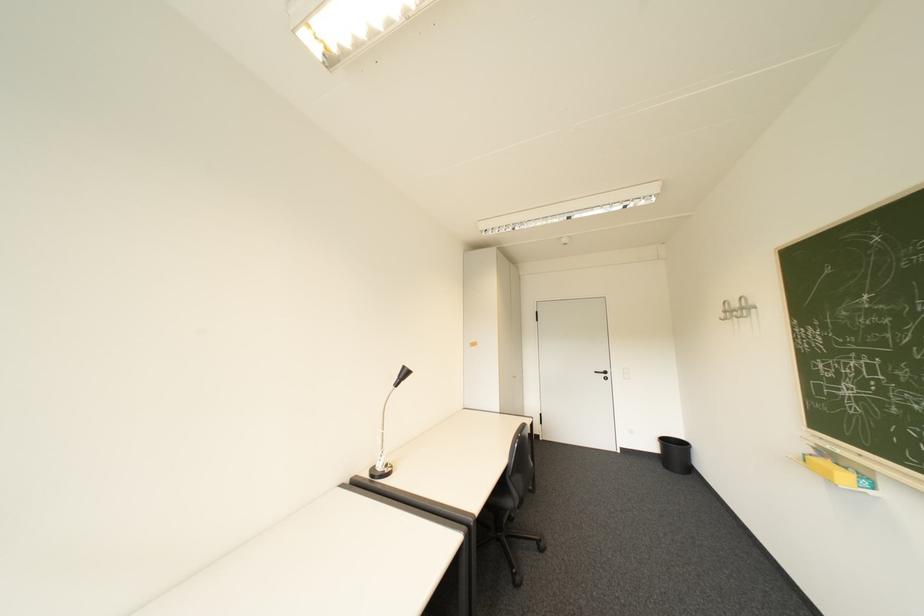
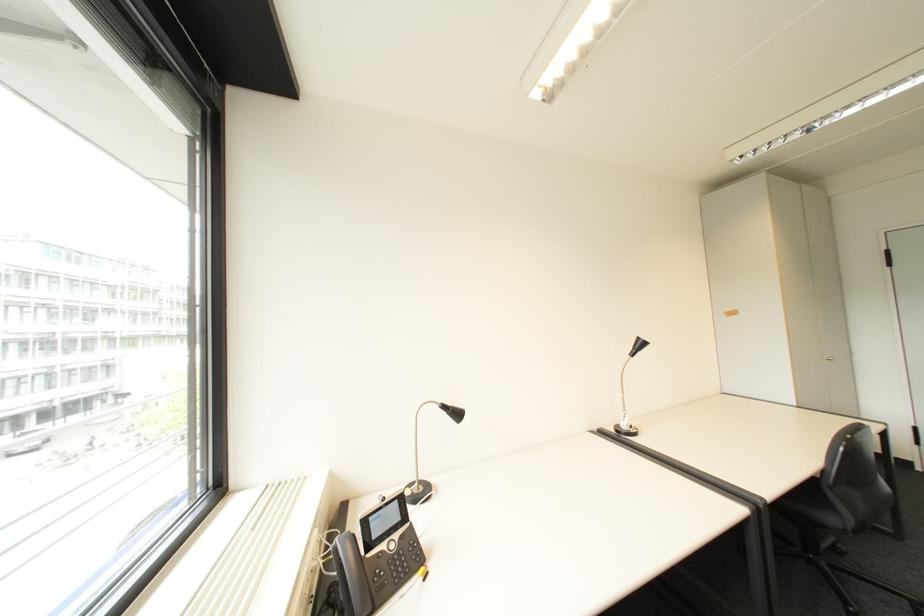
Question: How did the camera likely rotate?

Choices:
 (A) Left
 (B) Right
 (C) Up
 (D) Down

Answer: (A)